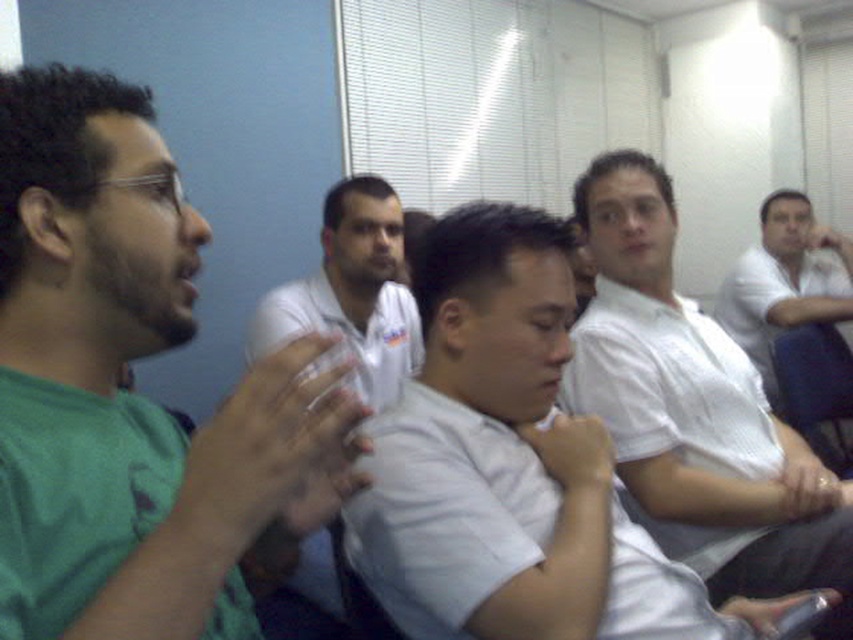
Which of these two, green matte shirt at left or white shirt at right, stands taller?

Standing taller between the two is white shirt at right.

Is green matte shirt at left above white shirt at right?

No.

What do you see at coordinates (131, 394) in the screenshot?
I see `green matte shirt at left` at bounding box center [131, 394].

The width and height of the screenshot is (853, 640). I want to click on green matte shirt at left, so click(131, 394).

Which of these two, white cotton shirt at center or white shirt at center, stands shorter?

With less height is white shirt at center.

Who is higher up, white cotton shirt at center or white shirt at center?

white shirt at center

Between point (583, 216) and point (415, 316), which one is positioned in front?

Point (583, 216) is in front.

This screenshot has height=640, width=853. What are the coordinates of `white cotton shirt at center` in the screenshot? It's located at (695, 412).

Which is more to the right, green matte shirt at left or white shirt at center?

green matte shirt at left is more to the right.

Consider the image. Does green matte shirt at left appear on the right side of white shirt at center?

Indeed, green matte shirt at left is positioned on the right side of white shirt at center.

Which is behind, point (253, 372) or point (309, 557)?

Positioned behind is point (309, 557).

You are a GUI agent. You are given a task and a screenshot of the screen. Output one action in this format:
    pyautogui.click(x=<x>, y=<y>)
    Task: Click on the green matte shirt at left
    
    Given the screenshot: What is the action you would take?
    pyautogui.click(x=131, y=394)